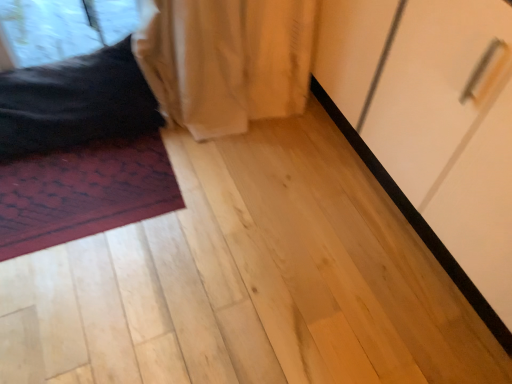
In order to click on white glossy cabinet handle at upper right in this screenshot , I will do [x=453, y=132].

What do you see at coordinates (453, 132) in the screenshot?
I see `white glossy cabinet handle at upper right` at bounding box center [453, 132].

This screenshot has height=384, width=512. What are the coordinates of `white glossy cabinet handle at upper right` in the screenshot? It's located at (453, 132).